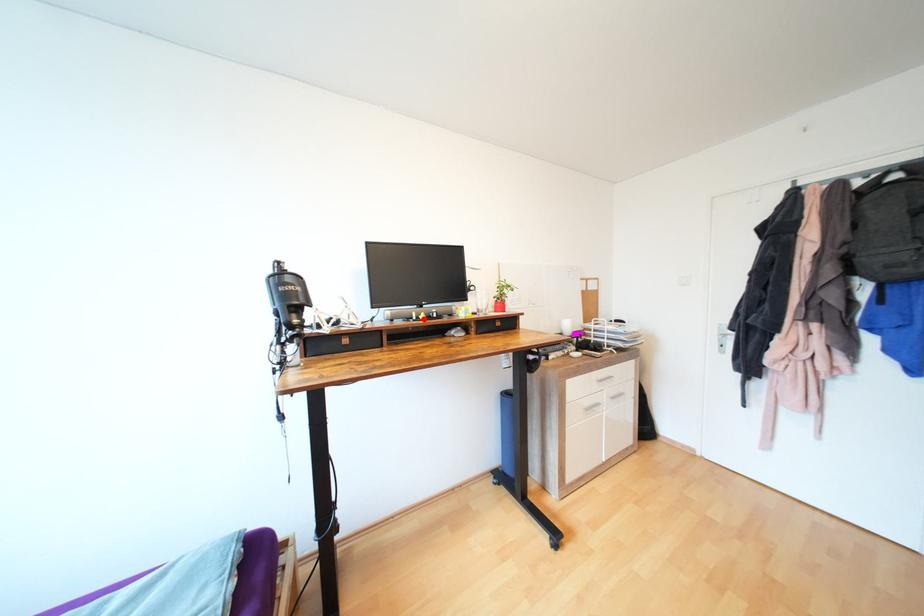
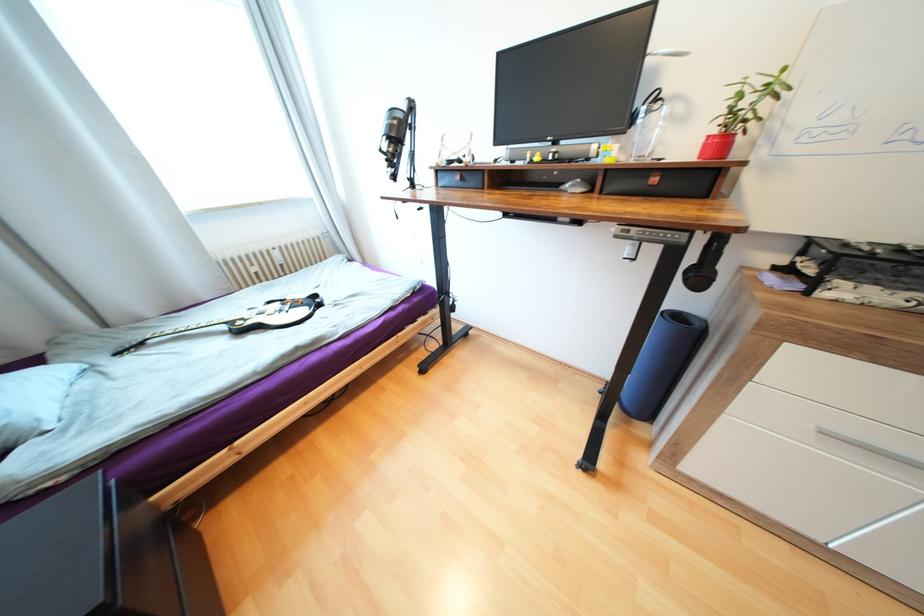
Find the pixel in the second image that matches the highlighted location in the first image.

(537, 161)